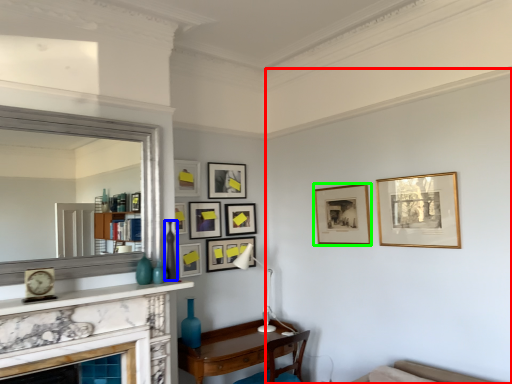
Question: Which object is the farthest from backdrop (highlighted by a red box)? Choose among these: vase (highlighted by a blue box) or picture frame (highlighted by a green box).

Choices:
 (A) vase
 (B) picture frame

Answer: (A)